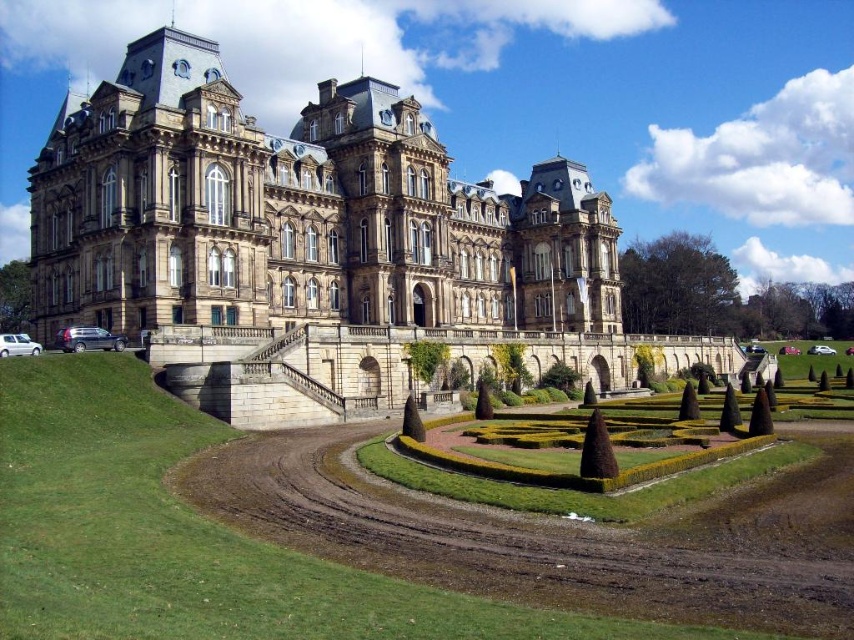
Question: Can you confirm if brown stone castle at center is positioned to the right of green grass at lower center?

Choices:
 (A) yes
 (B) no

Answer: (A)

Question: Which object is farther from the camera taking this photo?

Choices:
 (A) brown stone castle at center
 (B) green grass at lower center

Answer: (A)

Question: Is brown stone castle at center bigger than green grass at lower center?

Choices:
 (A) yes
 (B) no

Answer: (A)

Question: Does brown stone castle at center have a lesser width compared to green grass at lower center?

Choices:
 (A) yes
 (B) no

Answer: (B)